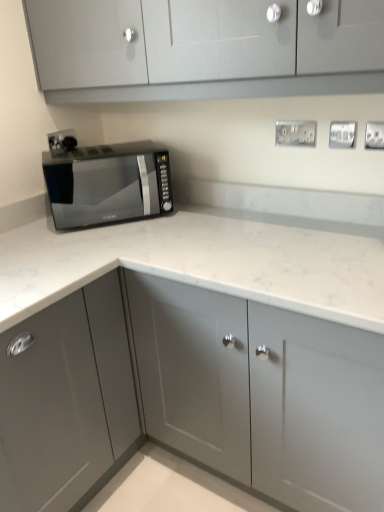
Question: Is matte gray cabinet at lower left, the first cabinetry ordered from the bottom, surrounded by black glass microwave at left?

Choices:
 (A) no
 (B) yes

Answer: (A)

Question: Is black glass microwave at left smaller than matte gray cabinet at lower left, placed as the third cabinetry when sorted from top to bottom?

Choices:
 (A) no
 (B) yes

Answer: (B)

Question: Is black glass microwave at left positioned before matte gray cabinet at lower left, placed as the third cabinetry when sorted from top to bottom?

Choices:
 (A) no
 (B) yes

Answer: (A)

Question: Is black glass microwave at left turned away from matte gray cabinet at lower left, the first cabinetry ordered from the bottom?

Choices:
 (A) yes
 (B) no

Answer: (B)

Question: Could you tell me if black glass microwave at left is facing matte gray cabinet at lower left, the first cabinetry ordered from the bottom?

Choices:
 (A) no
 (B) yes

Answer: (A)

Question: Is the depth of black glass microwave at left greater than that of matte gray cabinet at lower left, the first cabinetry ordered from the bottom?

Choices:
 (A) no
 (B) yes

Answer: (B)

Question: Is black plastic socket at upper left, placed as the 4th electric outlet when sorted from right to left, in contact with satin silver outlet at upper right, which ranks as the fourth electric outlet in back-to-front order?

Choices:
 (A) no
 (B) yes

Answer: (A)

Question: Is black plastic socket at upper left, placed as the 4th electric outlet when sorted from right to left, further to camera compared to satin silver outlet at upper right, the 1th electric outlet from the right?

Choices:
 (A) yes
 (B) no

Answer: (A)

Question: Is black plastic socket at upper left, the 1th electric outlet positioned from the left, positioned in front of satin silver outlet at upper right, the 1th electric outlet from the right?

Choices:
 (A) no
 (B) yes

Answer: (A)

Question: Could you tell me if black plastic socket at upper left, placed as the 4th electric outlet when sorted from right to left, is turned towards satin silver outlet at upper right, the 4th electric outlet from the left?

Choices:
 (A) yes
 (B) no

Answer: (A)

Question: From a real-world perspective, is black plastic socket at upper left, placed as the 4th electric outlet when sorted from right to left, on top of satin silver outlet at upper right, the 1th electric outlet positioned from the front?

Choices:
 (A) yes
 (B) no

Answer: (B)

Question: Is black plastic socket at upper left, the 1th electric outlet positioned from the left, positioned beyond the bounds of satin silver outlet at upper right, the 1th electric outlet positioned from the front?

Choices:
 (A) yes
 (B) no

Answer: (A)

Question: Does satin silver outlet at upper right, the 1th electric outlet positioned from the front, have a larger size compared to satin silver electrical outlet at upper center, the 3th electric outlet from the front?

Choices:
 (A) yes
 (B) no

Answer: (B)